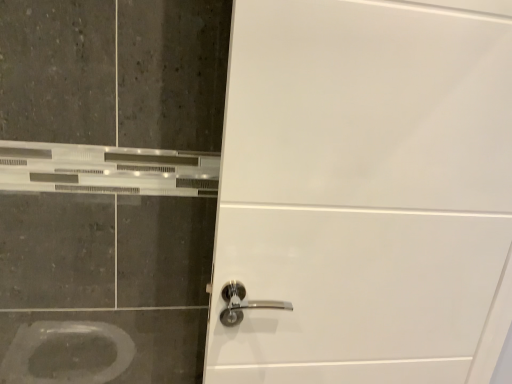
This screenshot has width=512, height=384. What do you see at coordinates (364, 193) in the screenshot? I see `white glossy door handle at center` at bounding box center [364, 193].

The height and width of the screenshot is (384, 512). Identify the location of white glossy door handle at center. click(x=364, y=193).

You are a GUI agent. You are given a task and a screenshot of the screen. Output one action in this format:
    pyautogui.click(x=<x>, y=<y>)
    Task: Click on the white glossy door handle at center
    The width and height of the screenshot is (512, 384).
    Given the screenshot: What is the action you would take?
    pyautogui.click(x=364, y=193)